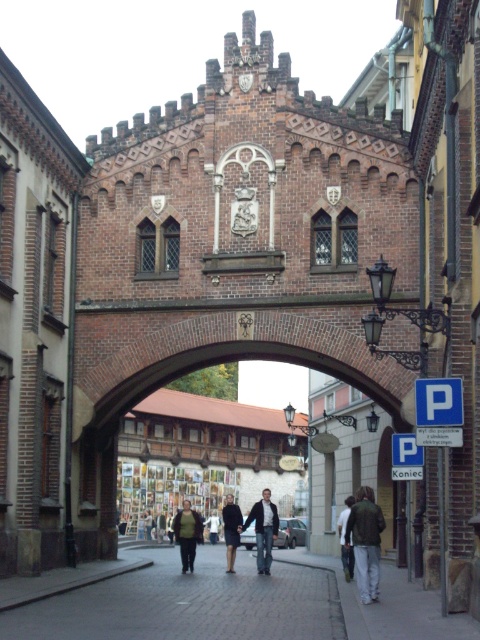
You are a fashion designer observing a person standing under the historic brick archway. You notice the person is wearing the dark blue jeans at center and the green wool sweater at center. Which clothing item appears taller on the person?

The dark blue jeans at center appears taller than the green wool sweater at center on the person.

Based on the photo, you are a passerby on the cobblestone street and you see both the green wool sweater at center and the dark gray jacket at center. Which one is closer to the ground?

The green wool sweater at center is positioned under the dark gray jacket at center, so the green wool sweater at center is closer to the ground.

Consider the image. You are a tourist standing in the middle of the street. You see the brick pavement at center and the dark gray jacket at center. Which object is closer to you?

The brick pavement at center is closer to you because it is in front of the dark gray jacket at center.